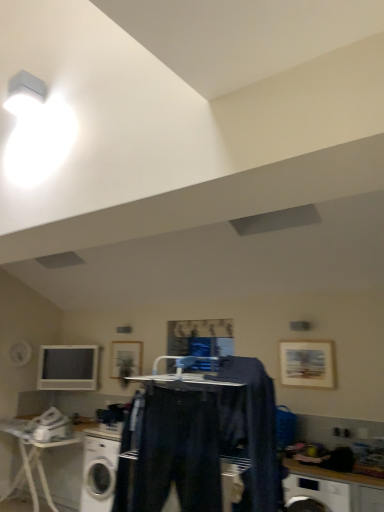
Question: Is white plastic table at lower left at the right side of wooden framed picture at center, the second picture frame viewed from the right?

Choices:
 (A) no
 (B) yes

Answer: (A)

Question: From the image's perspective, is white plastic table at lower left below wooden framed picture at center, the 1th picture frame from the back?

Choices:
 (A) yes
 (B) no

Answer: (A)

Question: Considering the relative sizes of white plastic table at lower left and wooden framed picture at center, the 1th picture frame from the back, in the image provided, is white plastic table at lower left taller than wooden framed picture at center, the 1th picture frame from the back,?

Choices:
 (A) no
 (B) yes

Answer: (B)

Question: Is white plastic table at lower left to the left of wooden framed picture at center, the 1th picture frame from the back, from the viewer's perspective?

Choices:
 (A) yes
 (B) no

Answer: (A)

Question: Is wooden framed picture at center, which ranks as the first picture frame in left-to-right order, at the back of white plastic table at lower left?

Choices:
 (A) no
 (B) yes

Answer: (A)

Question: From a real-world perspective, is white plastic iron at lower left above or below dark blue fabric at center, the second clothing from the left?

Choices:
 (A) below
 (B) above

Answer: (A)

Question: In terms of width, does white plastic iron at lower left look wider or thinner when compared to dark blue fabric at center, the second clothing from the left?

Choices:
 (A) wide
 (B) thin

Answer: (A)

Question: From their relative heights in the image, would you say white plastic iron at lower left is taller or shorter than dark blue fabric at center, the first clothing positioned from the right?

Choices:
 (A) short
 (B) tall

Answer: (A)

Question: Which is correct: white plastic iron at lower left is inside dark blue fabric at center, the second clothing from the left, or outside of it?

Choices:
 (A) inside
 (B) outside

Answer: (B)

Question: From the image's perspective, is white plastic iron at lower left located above or below wooden countertop at lower right?

Choices:
 (A) below
 (B) above

Answer: (B)

Question: Is white plastic iron at lower left inside the boundaries of wooden countertop at lower right, or outside?

Choices:
 (A) outside
 (B) inside

Answer: (A)

Question: Considering the positions of white plastic iron at lower left and wooden countertop at lower right in the image, is white plastic iron at lower left bigger or smaller than wooden countertop at lower right?

Choices:
 (A) small
 (B) big

Answer: (A)

Question: In terms of height, does white plastic iron at lower left look taller or shorter compared to wooden countertop at lower right?

Choices:
 (A) tall
 (B) short

Answer: (B)

Question: From a real-world perspective, is white glossy washing machine at lower left positioned above or below dark blue fabric at center, the second clothing from the left?

Choices:
 (A) below
 (B) above

Answer: (A)

Question: In terms of width, does white glossy washing machine at lower left look wider or thinner when compared to dark blue fabric at center, the first clothing positioned from the right?

Choices:
 (A) wide
 (B) thin

Answer: (A)